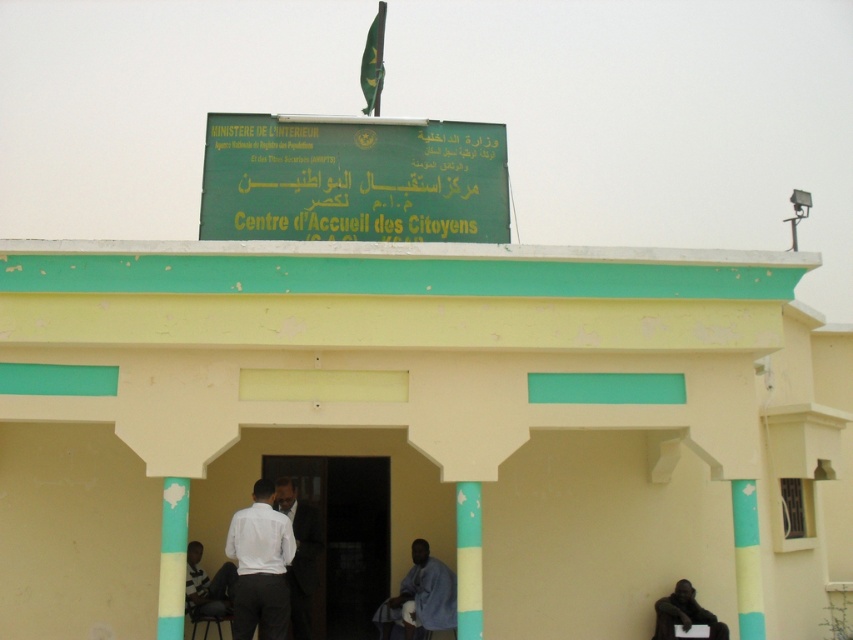
What is the exact location of the blue fabric shirt at center in the image?

The blue fabric shirt at center is located at point [421,596].

You are a visitor at the Citizens Reception Center. You see a person wearing a blue fabric shirt at center and a person wearing a dark suit at center. Which person is closer to you?

The blue fabric shirt at center is closer to you because it is further to the viewer than the dark suit at center.

You are a visitor arriving at the Citizens Reception Center. You see the dark wood door at center and the dark skin statue at lower right. Which object is closer to the ground?

The dark skin statue at lower right is closer to the ground since it is positioned below the dark wood door at center.